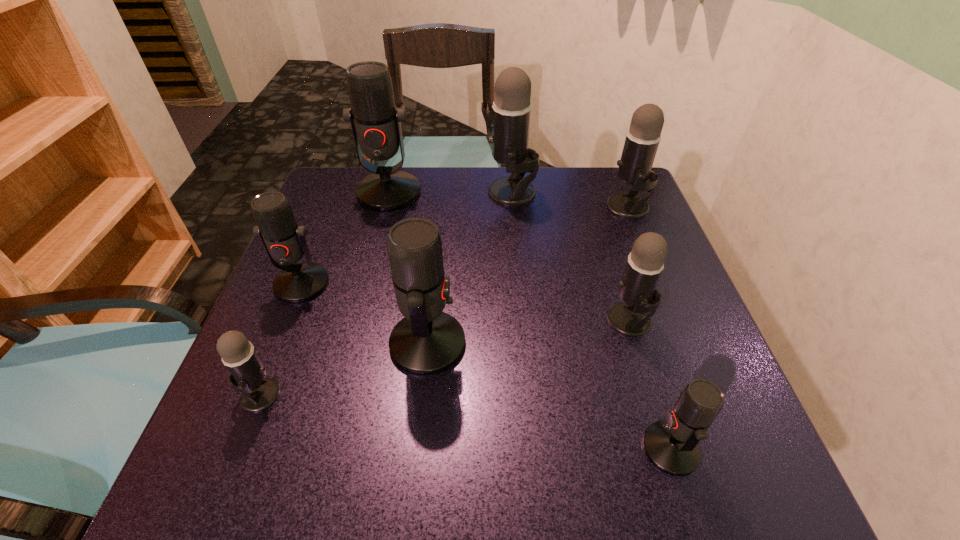
Find the location of `vacant space at the near left corner of the desktop`. vacant space at the near left corner of the desktop is located at coordinates (250, 442).

In the image, there is a desktop. Identify the location of free space at the far right corner. (627, 189).

I want to click on vacant space that is in between the biggest gray microphone and the farthest red microphone, so click(450, 193).

Locate an element on the screen. This screenshot has width=960, height=540. free point between the biggest gray microphone and the biggest red microphone is located at coordinates (450, 193).

This screenshot has height=540, width=960. I want to click on vacant space that is in between the second biggest gray microphone and the third biggest red microphone, so click(x=465, y=245).

At what (x,y) coordinates should I click in order to perform the action: click on vacant area that lies between the third farthest red microphone and the leftmost gray microphone. Please return your answer as a coordinate pair (x, y). Image resolution: width=960 pixels, height=540 pixels. Looking at the image, I should click on (344, 369).

This screenshot has height=540, width=960. Identify the location of vacant point located between the biggest red microphone and the third biggest red microphone. (346, 238).

I want to click on empty location between the second biggest gray microphone and the second nearest red microphone, so click(x=528, y=275).

Find the location of a particular element. The image size is (960, 540). free space between the second nearest microphone and the nearest red microphone is located at coordinates (466, 421).

Identify the location of the closest object to the farthest red microphone. (511, 112).